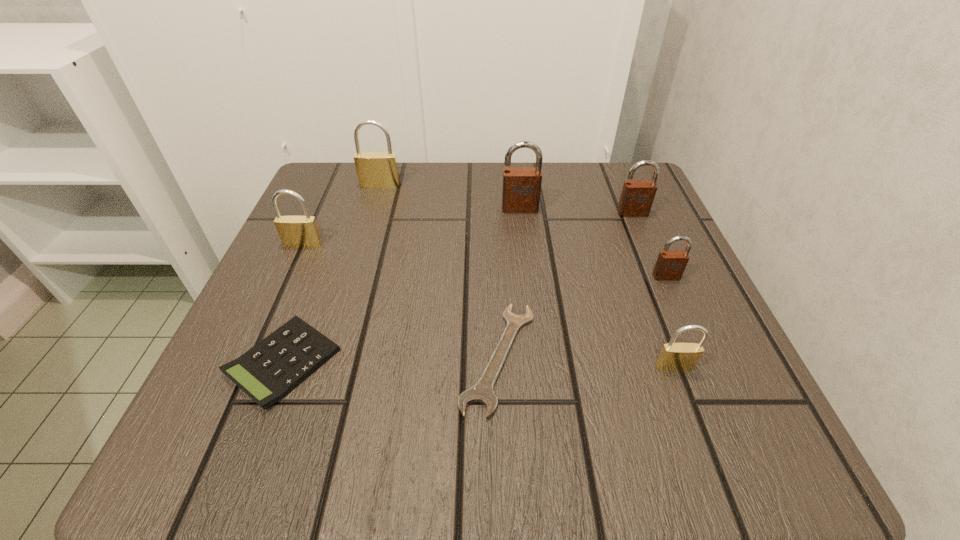
What are the coordinates of `free location at the right edge of the desktop` in the screenshot? It's located at (720, 383).

At what (x,y) coordinates should I click in order to perform the action: click on vacant space at the far left corner of the desktop. Please return your answer as a coordinate pair (x, y). The width and height of the screenshot is (960, 540). Looking at the image, I should click on (340, 222).

This screenshot has height=540, width=960. In the image, there is a desktop. Find the location of `free space at the far right corner`. free space at the far right corner is located at coordinates (576, 179).

Image resolution: width=960 pixels, height=540 pixels. Find the location of `blank space at the near right corner`. blank space at the near right corner is located at coordinates (771, 462).

Locate an element on the screen. The height and width of the screenshot is (540, 960). vacant space in between the nearest brown padlock and the calculator is located at coordinates (474, 319).

You are a GUI agent. You are given a task and a screenshot of the screen. Output one action in this format:
    pyautogui.click(x=<x>, y=<y>)
    Task: Click on the free point between the biggest brass padlock and the biggest brown padlock
    
    Given the screenshot: What is the action you would take?
    pyautogui.click(x=450, y=197)

I want to click on free point between the smallest brass padlock and the biggest brown padlock, so click(x=597, y=287).

This screenshot has height=540, width=960. What are the coordinates of `free space between the smallest brass padlock and the leftmost brass padlock` in the screenshot? It's located at pos(489,306).

You are a GUI agent. You are given a task and a screenshot of the screen. Output one action in this format:
    pyautogui.click(x=<x>, y=<y>)
    Task: Click on the free space between the nearest brown padlock and the farthest padlock
    
    Given the screenshot: What is the action you would take?
    pyautogui.click(x=523, y=231)

Where is `vacant area that lies between the leftmost brown padlock and the farthest brass padlock`? The height and width of the screenshot is (540, 960). vacant area that lies between the leftmost brown padlock and the farthest brass padlock is located at coordinates (450, 197).